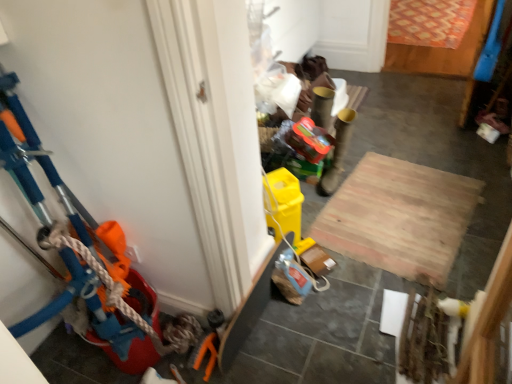
You are a GUI agent. You are given a task and a screenshot of the screen. Output one action in this format:
    pyautogui.click(x=<x>, y=<y>)
    Task: Click on the free space to the right of wooden at center
    The image size is (512, 384).
    Given the screenshot: What is the action you would take?
    pyautogui.click(x=479, y=184)